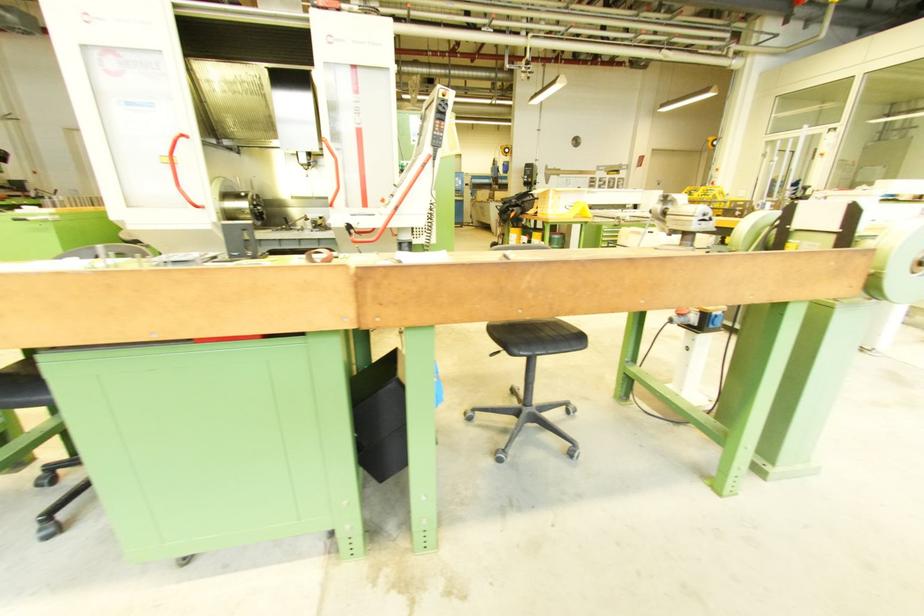
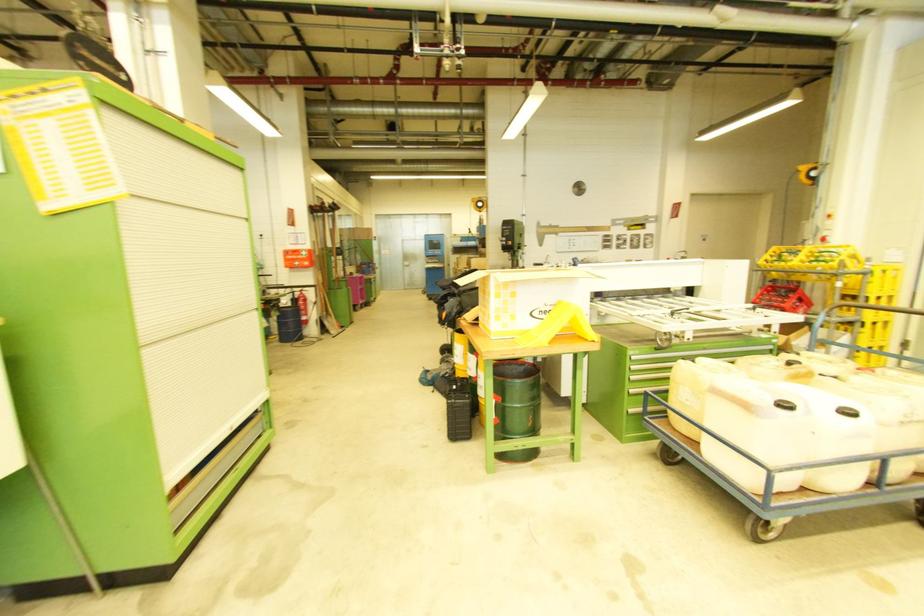
Where in the second image is the point corresponding to the point at 562,200 from the first image?

(516, 297)